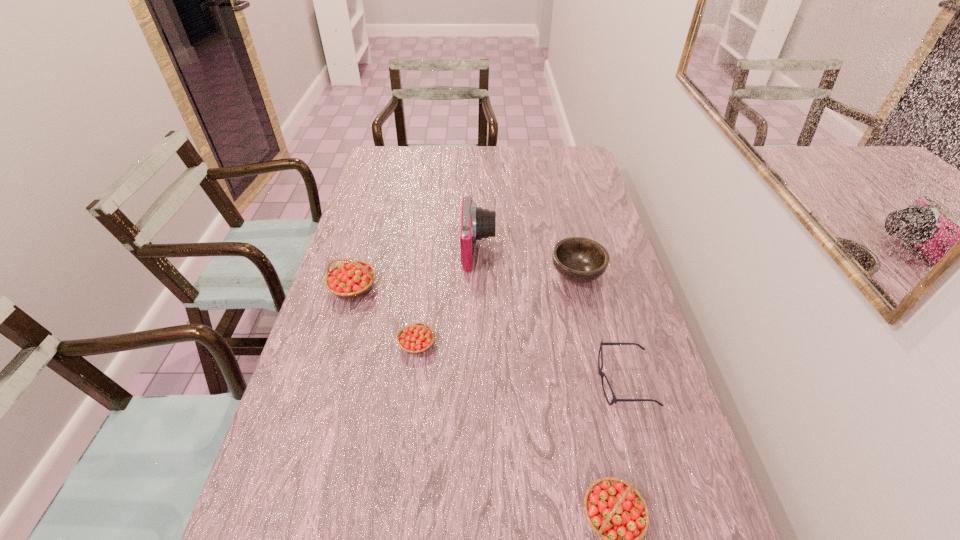
Find the location of a particular element. The width and height of the screenshot is (960, 540). vacant space located on the front-facing side of the fourth object from right to left is located at coordinates (615, 251).

I want to click on vacant space located on the left of the bowl, so click(452, 273).

The width and height of the screenshot is (960, 540). I want to click on blank space located on the front-facing side of the shortest object, so click(486, 382).

The height and width of the screenshot is (540, 960). Find the location of `vacant space situated on the front-facing side of the shortest object`. vacant space situated on the front-facing side of the shortest object is located at coordinates (502, 382).

Where is `free region located 0.180m on the front-facing side of the shortest object`? free region located 0.180m on the front-facing side of the shortest object is located at coordinates (522, 382).

Identify the location of object at the left edge. (353, 278).

Where is `bowl present at the right edge`? This screenshot has width=960, height=540. bowl present at the right edge is located at coordinates (577, 259).

What are the coordinates of `spectacles that is at the right edge` in the screenshot? It's located at (602, 374).

The width and height of the screenshot is (960, 540). What are the coordinates of `vacant region at the far edge of the desktop` in the screenshot? It's located at (464, 162).

Identify the location of free space at the left edge of the desktop. This screenshot has width=960, height=540. (371, 303).